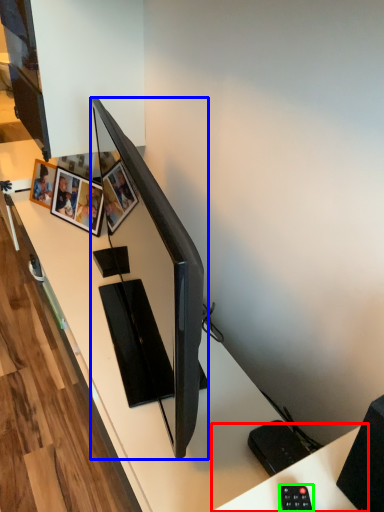
Question: Which object is positioned farthest from computer desk (highlighted by a red box)? Select from television (highlighted by a blue box) and control (highlighted by a green box).

Choices:
 (A) television
 (B) control

Answer: (A)